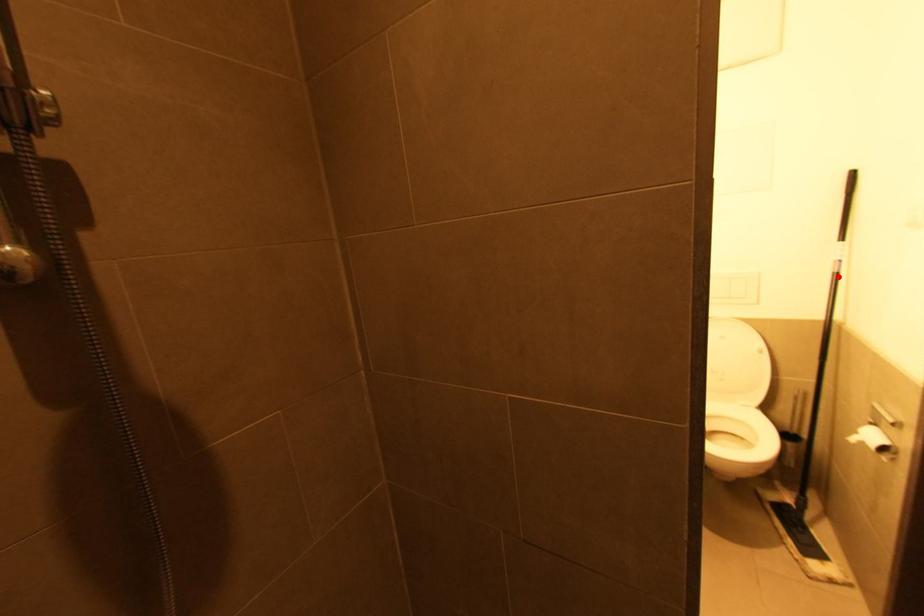
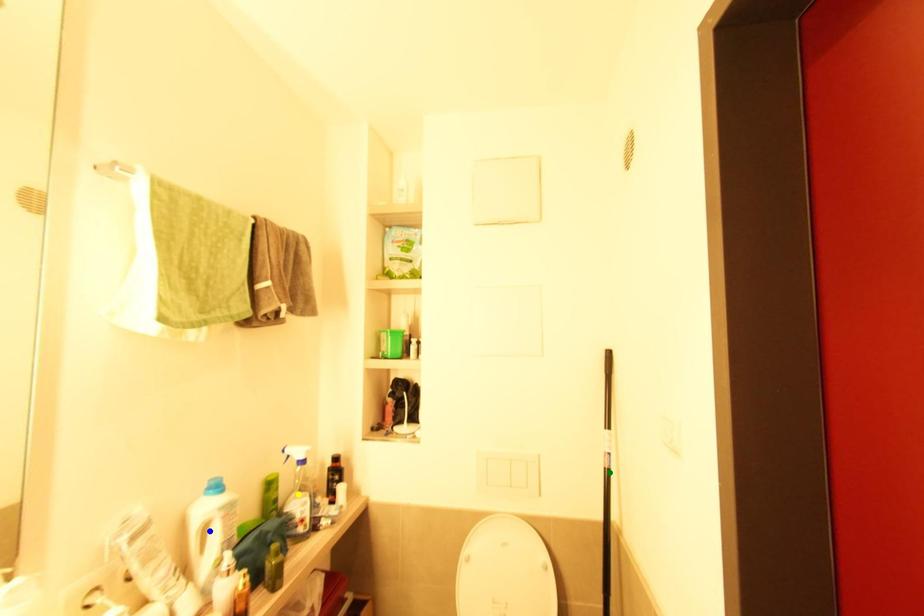
Question: I am providing you with two images of the same scene from different viewpoints. A red point is marked on the first image. You are given multiple points on the second image. Which mark in image 2 goes with the point in image 1?

Choices:
 (A) blue point
 (B) green point
 (C) yellow point

Answer: (B)